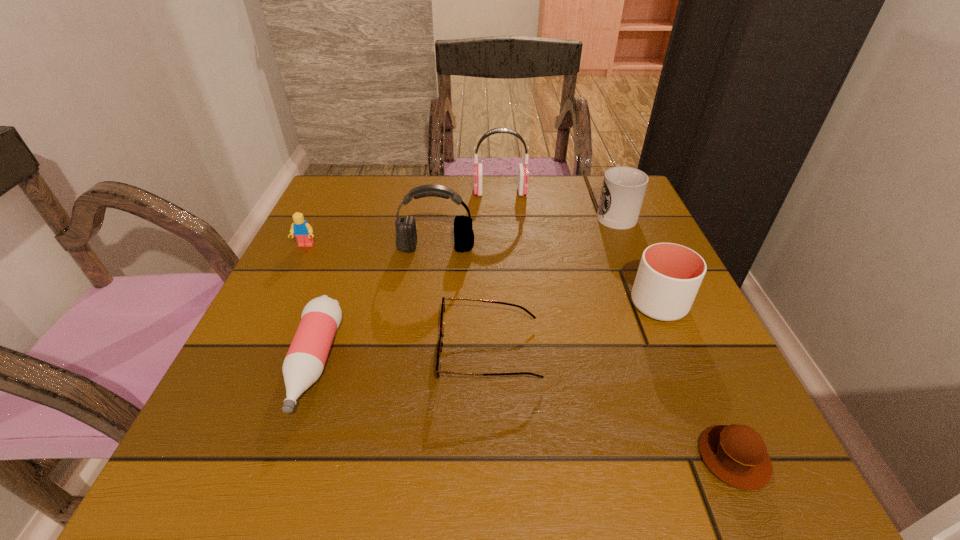
Find the location of `earphone`. earphone is located at coordinates (523, 174).

You are a GUI agent. You are given a task and a screenshot of the screen. Output one action in this format:
    pyautogui.click(x=<x>, y=<y>)
    Task: Click on the headset
    Image resolution: width=960 pixels, height=540 pixels.
    Given the screenshot: What is the action you would take?
    pyautogui.click(x=406, y=239)

Locate an element on the screen. The width and height of the screenshot is (960, 540). the farther cup is located at coordinates (623, 190).

Identify the location of the nearer cup. pos(669,275).

You are a GUI agent. You are given a task and a screenshot of the screen. Output one action in this format:
    pyautogui.click(x=<x>, y=<y>)
    Task: Click on the Lego
    The image size is (960, 540).
    Given the screenshot: What is the action you would take?
    pyautogui.click(x=300, y=228)

Locate an element on the screen. the fourth shortest object is located at coordinates (300, 228).

Find the location of a particular element. bottle is located at coordinates (305, 360).

Identify the location of spectacles. The width and height of the screenshot is (960, 540). (440, 343).

Identify the location of muffin. (736, 454).

The width and height of the screenshot is (960, 540). I want to click on free space located 0.270m on the outer surface of the earphone, so click(x=372, y=192).